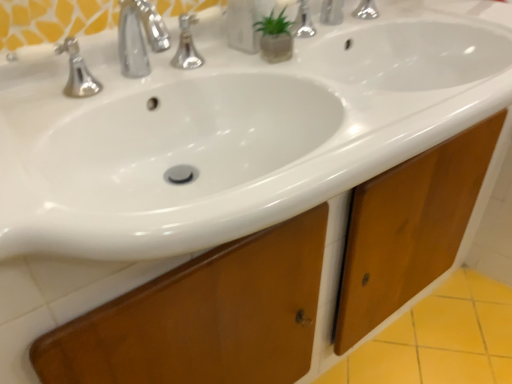
Question: Does transparent plastic soap dispenser at upper center have a smaller size compared to white glossy sink at center?

Choices:
 (A) no
 (B) yes

Answer: (B)

Question: Is transparent plastic soap dispenser at upper center at the right side of white glossy sink at center?

Choices:
 (A) no
 (B) yes

Answer: (A)

Question: Is transparent plastic soap dispenser at upper center not close to white glossy sink at center?

Choices:
 (A) yes
 (B) no

Answer: (B)

Question: Can you confirm if transparent plastic soap dispenser at upper center is thinner than white glossy sink at center?

Choices:
 (A) yes
 (B) no

Answer: (A)

Question: Could white glossy sink at center be considered to be inside transparent plastic soap dispenser at upper center?

Choices:
 (A) yes
 (B) no

Answer: (B)

Question: Does transparent plastic soap dispenser at upper center come behind white glossy sink at center?

Choices:
 (A) no
 (B) yes

Answer: (B)

Question: Are white glossy sink at center and transparent plastic soap dispenser at upper center located far from each other?

Choices:
 (A) yes
 (B) no

Answer: (B)

Question: Is white glossy sink at center smaller than transparent plastic soap dispenser at upper center?

Choices:
 (A) yes
 (B) no

Answer: (B)

Question: Is white glossy sink at center further to camera compared to transparent plastic soap dispenser at upper center?

Choices:
 (A) no
 (B) yes

Answer: (A)

Question: Is white glossy sink at center aimed at transparent plastic soap dispenser at upper center?

Choices:
 (A) no
 (B) yes

Answer: (A)

Question: Considering the relative positions of white glossy sink at center and transparent plastic soap dispenser at upper center in the image provided, is white glossy sink at center to the left of transparent plastic soap dispenser at upper center from the viewer's perspective?

Choices:
 (A) no
 (B) yes

Answer: (A)

Question: Considering the relative sizes of white glossy sink at center and transparent plastic soap dispenser at upper center in the image provided, is white glossy sink at center taller than transparent plastic soap dispenser at upper center?

Choices:
 (A) yes
 (B) no

Answer: (A)

Question: In the image, is transparent plastic soap dispenser at upper center positioned in front of or behind white glossy sink at center?

Choices:
 (A) front
 (B) behind

Answer: (B)